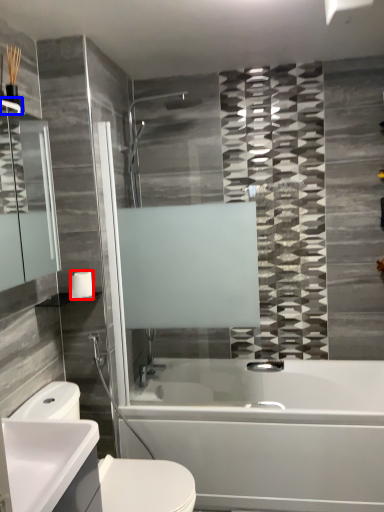
Question: Which point is closer to the camera, toilet paper (highlighted by a red box) or towel bar (highlighted by a blue box)?

Choices:
 (A) toilet paper
 (B) towel bar

Answer: (B)